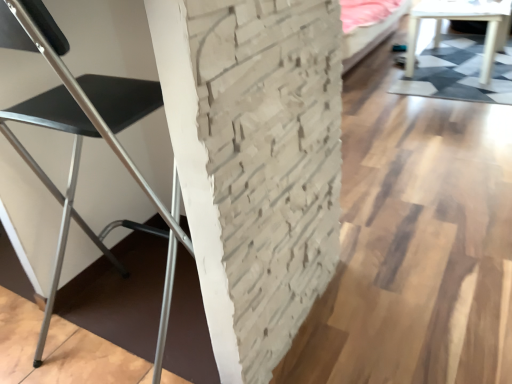
Measure the distance between point (77, 118) and camera.

Point (77, 118) is 35.28 inches away from camera.

The height and width of the screenshot is (384, 512). What do you see at coordinates (82, 141) in the screenshot? I see `black metal chair at left` at bounding box center [82, 141].

Where is `black metal chair at left`? Image resolution: width=512 pixels, height=384 pixels. black metal chair at left is located at coordinates (82, 141).

Describe the element at coordinates (462, 19) in the screenshot. I see `white glossy table at upper right` at that location.

What are the coordinates of `white glossy table at upper right` in the screenshot? It's located at (462, 19).

Locate an element on the screen. The image size is (512, 384). black metal chair at left is located at coordinates (82, 141).

From the picture: Considering the relative positions of black metal chair at left and white glossy table at upper right in the image provided, is black metal chair at left to the right of white glossy table at upper right from the viewer's perspective?

Incorrect, black metal chair at left is not on the right side of white glossy table at upper right.

From the picture: Considering the positions of objects black metal chair at left and white glossy table at upper right in the image provided, who is behind, black metal chair at left or white glossy table at upper right?

white glossy table at upper right is more distant.

Considering the points (11, 13) and (473, 5), which point is in front, point (11, 13) or point (473, 5)?

The point (11, 13) is more forward.

From the image's perspective, is black metal chair at left on top of white glossy table at upper right?

Actually, black metal chair at left appears below white glossy table at upper right in the image.

From a real-world perspective, is black metal chair at left positioned under white glossy table at upper right based on gravity?

Actually, black metal chair at left is physically above white glossy table at upper right in the real world.

Considering the sizes of objects black metal chair at left and white glossy table at upper right in the image provided, who is wider, black metal chair at left or white glossy table at upper right?

With larger width is white glossy table at upper right.

Does black metal chair at left have a lesser height compared to white glossy table at upper right?

No.

Between black metal chair at left and white glossy table at upper right, which one has smaller size?

With smaller size is black metal chair at left.

Is black metal chair at left not within white glossy table at upper right?

Yes.

From the picture: Is black metal chair at left directly adjacent to white glossy table at upper right?

black metal chair at left and white glossy table at upper right are clearly separated.

Could you tell me if black metal chair at left is facing white glossy table at upper right?

Yes, black metal chair at left faces towards white glossy table at upper right.

Can you tell me how much black metal chair at left and white glossy table at upper right differ in facing direction?

black metal chair at left and white glossy table at upper right are facing 90 degrees away from each other.

The image size is (512, 384). I want to click on table behind the black metal chair at left, so click(x=462, y=19).

Considering the relative positions of white glossy table at upper right and black metal chair at left in the image provided, is white glossy table at upper right to the left of black metal chair at left from the viewer's perspective?

No, white glossy table at upper right is not to the left of black metal chair at left.

Is white glossy table at upper right closer to camera compared to black metal chair at left?

No, it is not.

Is point (505, 0) in front of point (121, 84)?

No, (505, 0) is further to viewer.

From the picture: From the image's perspective, does white glossy table at upper right appear lower than black metal chair at left?

No, from the image's perspective, white glossy table at upper right is not beneath black metal chair at left.

From a real-world perspective, is white glossy table at upper right over black metal chair at left?

No.

Is white glossy table at upper right wider or thinner than black metal chair at left?

Clearly, white glossy table at upper right has more width compared to black metal chair at left.

Considering the sizes of white glossy table at upper right and black metal chair at left in the image, is white glossy table at upper right taller or shorter than black metal chair at left?

In the image, white glossy table at upper right appears to be shorter than black metal chair at left.

Considering the sizes of objects white glossy table at upper right and black metal chair at left in the image provided, who is bigger, white glossy table at upper right or black metal chair at left?

Bigger between the two is white glossy table at upper right.

Is white glossy table at upper right outside of black metal chair at left?

Indeed, white glossy table at upper right is completely outside black metal chair at left.

From the picture: Is white glossy table at upper right far from black metal chair at left?

Yes.

Is white glossy table at upper right positioned with its back to black metal chair at left?

No, white glossy table at upper right is not facing away from black metal chair at left.

Where is `table that is above the black metal chair at left (from the image's perspective)`? The height and width of the screenshot is (384, 512). table that is above the black metal chair at left (from the image's perspective) is located at coordinates (462, 19).

Image resolution: width=512 pixels, height=384 pixels. What are the coordinates of `table lying behind the black metal chair at left` in the screenshot? It's located at 462,19.

What are the coordinates of `chair in front of the white glossy table at upper right` in the screenshot? It's located at (82, 141).